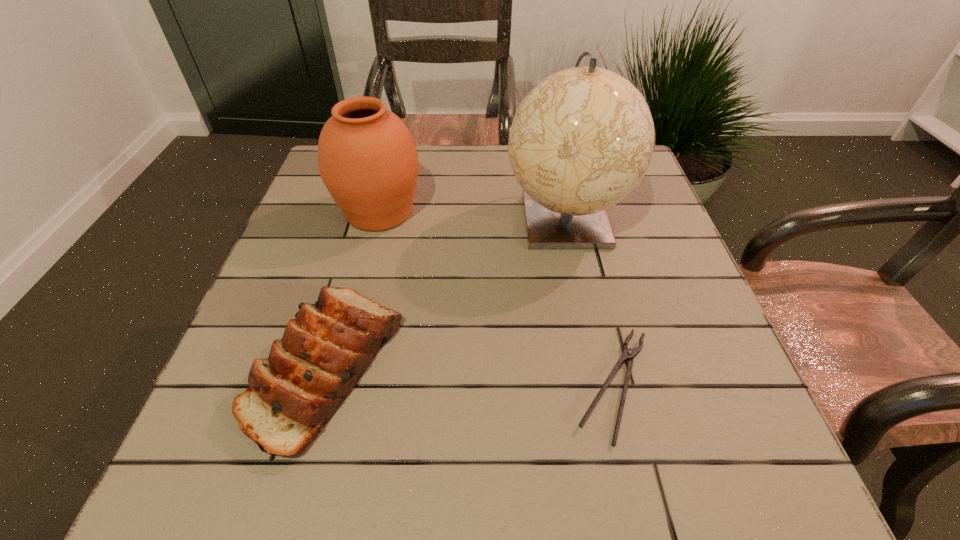
This screenshot has height=540, width=960. I want to click on globe, so click(x=581, y=140).

The height and width of the screenshot is (540, 960). I want to click on urn, so click(367, 159).

Identify the location of the second shortest object. The height and width of the screenshot is (540, 960). (324, 351).

Identify the location of the shortest object. This screenshot has height=540, width=960. (628, 355).

You are a GUI agent. You are given a task and a screenshot of the screen. Output one action in this format:
    pyautogui.click(x=<x>, y=<y>)
    Task: Click on the blank space located 0.220m on the surface of the globe showing Europe and Africa
    The width and height of the screenshot is (960, 540).
    Given the screenshot: What is the action you would take?
    592,349

Where is `vacant space located 0.150m on the front of the urn`? This screenshot has height=540, width=960. vacant space located 0.150m on the front of the urn is located at coordinates (359, 289).

The width and height of the screenshot is (960, 540). Identify the location of free region located on the right of the bread. (448, 367).

Image resolution: width=960 pixels, height=540 pixels. I want to click on free space located 0.130m on the back of the tongs, so (x=589, y=284).

Where is `globe present at the far edge`? This screenshot has height=540, width=960. globe present at the far edge is located at coordinates (581, 140).

Locate an element on the screen. Image resolution: width=960 pixels, height=540 pixels. urn that is at the far edge is located at coordinates (367, 159).